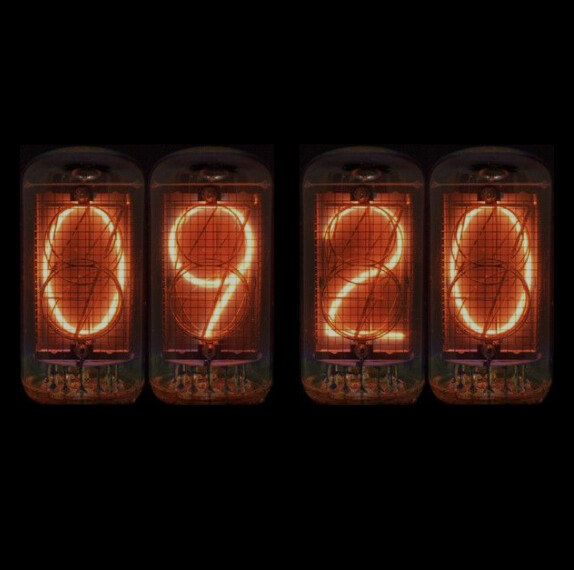
Locate an element on the screen. hook is located at coordinates (89, 174), (217, 179), (366, 166), (470, 174).